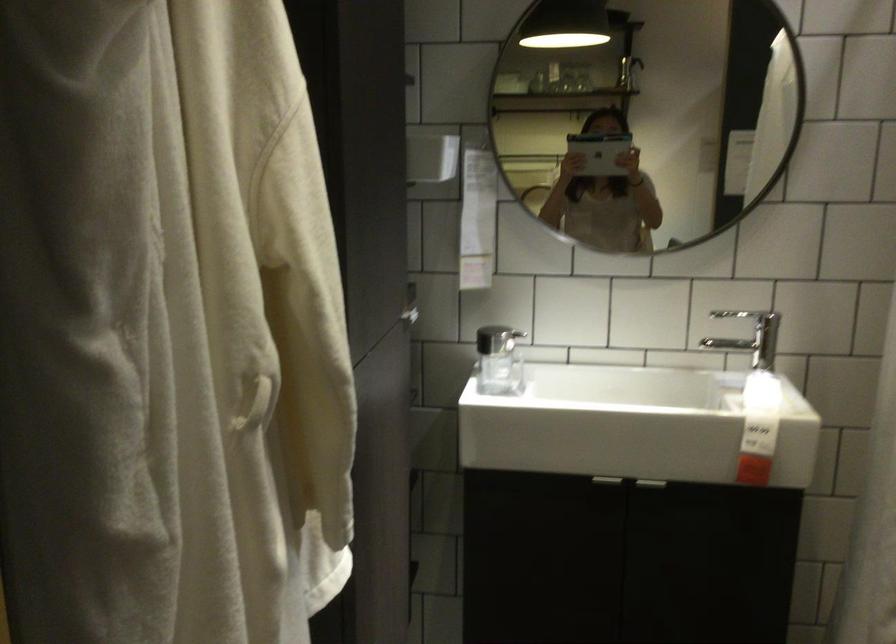
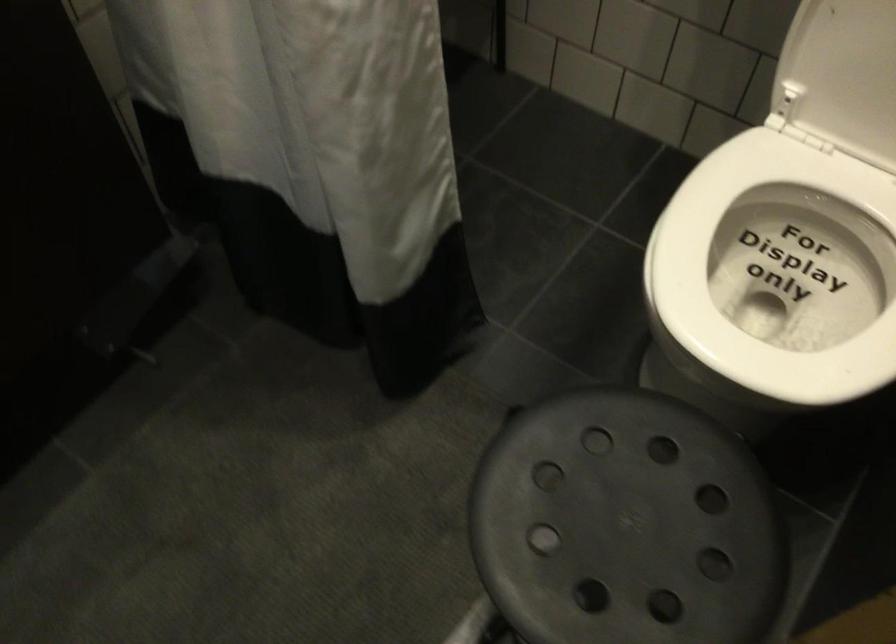
How did the camera likely rotate?

The rotation direction of the camera is right-down.